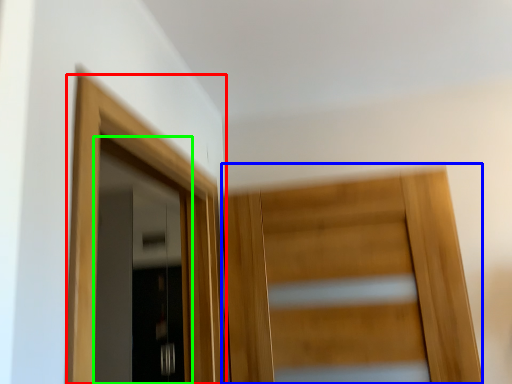
Question: Estimate the real-world distances between objects in this image. Which object is closer to door (highlighted by a red box), door (highlighted by a blue box) or door (highlighted by a green box)?

Choices:
 (A) door
 (B) door

Answer: (A)